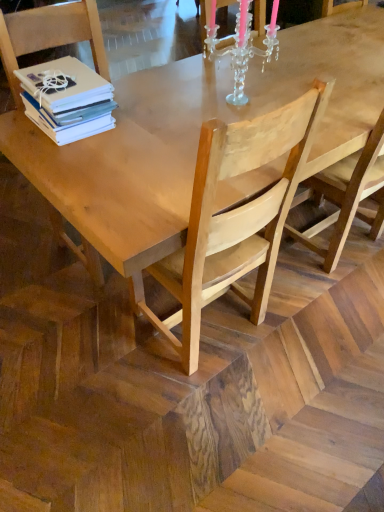
At what (x,y) coordinates should I click in order to perform the action: click on vacant area on the back side of clear crystal candle holder at upper center. Please return your answer as a coordinate pair (x, y). Looking at the image, I should click on (220, 81).